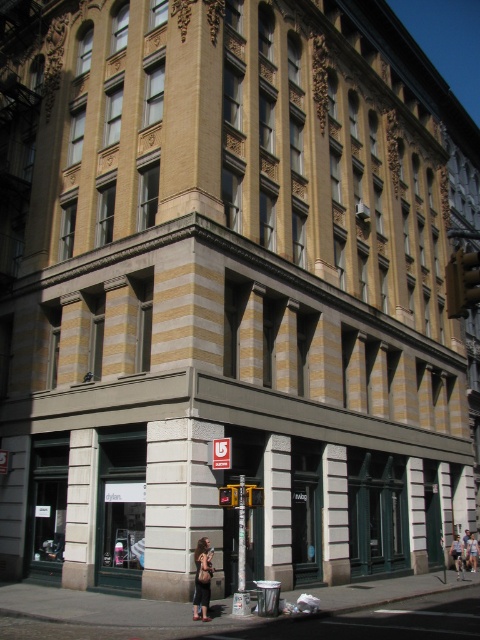
You are standing on the sidewalk in front of the building. You see a point marked at coordinates (x=81, y=509). Where is this point located?

The point is located on the white stone pillar at lower left.

You are a tailor who needs to determine which jacket requires more fabric to make between the dark brown leather jacket at lower center and the denim jacket at lower right. Which one would you choose?

The dark brown leather jacket at lower center requires more fabric because its width is larger than the denim jacket at lower right.